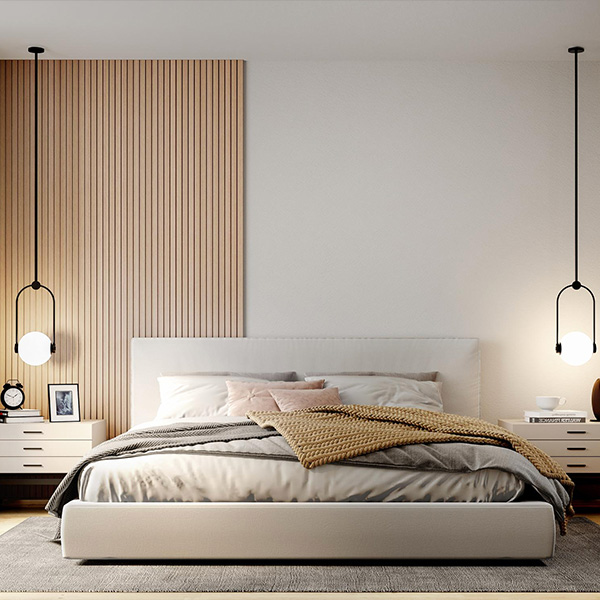
You are a GUI agent. You are given a task and a screenshot of the screen. Output one action in this format:
    pyautogui.click(x=<x>, y=<y>)
    Task: Click on the light
    
    Given the screenshot: What is the action you would take?
    pyautogui.click(x=579, y=344), pyautogui.click(x=39, y=350)